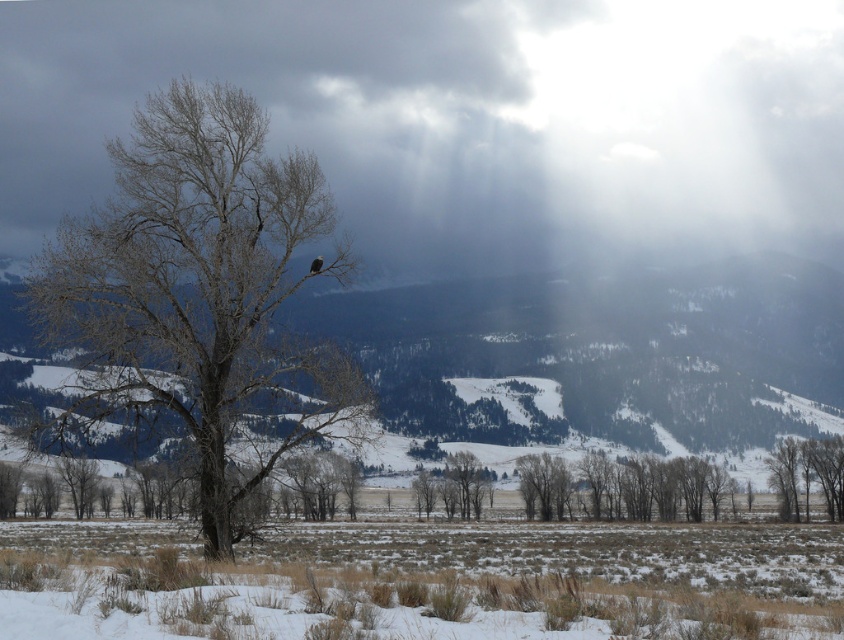
You are an ornithologist studying bird habitats in winter landscapes. You observe a gray bark tree at center in the image. Based on its position coordinates, can you determine if this tree is located in the foreground or midground of the scene?

The gray bark tree at center is located at coordinates point (201,296), which places it in the foreground of the scene as it is closer to the viewer compared to the midground and background elements described in the scene.

You are a hiker trying to estimate distances in the winter landscape. You see the gray bark tree at center and the smooth brown tree at lower right. How far apart are these two trees?

The gray bark tree at center is 106.51 meters from the smooth brown tree at lower right.

You are standing at the center of the winter landscape and want to locate the smooth brown tree at lower right. According to the coordinates provided, where should you look relative to your position?

The smooth brown tree at lower right is located at coordinates point (x=805, y=474), which means you should look to the right and slightly downward from your central position to find it.